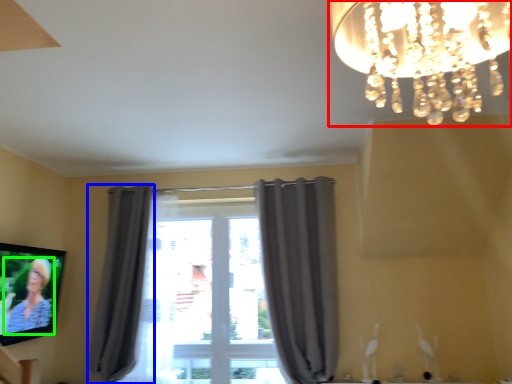
Question: Which object is positioned closest to lamp (highlighted by a red box)? Select from curtain (highlighted by a blue box) and person (highlighted by a green box).

Choices:
 (A) curtain
 (B) person

Answer: (B)